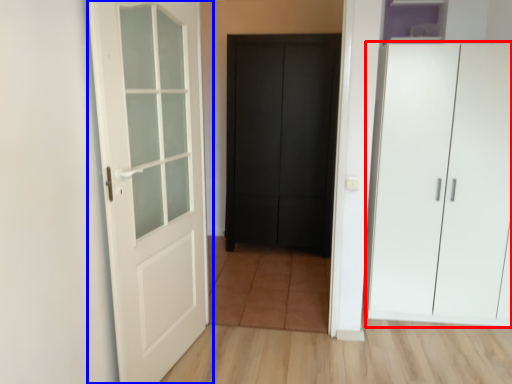
Question: Which object appears closest to the camera in this image, cupboard (highlighted by a red box) or door (highlighted by a blue box)?

Choices:
 (A) cupboard
 (B) door

Answer: (B)